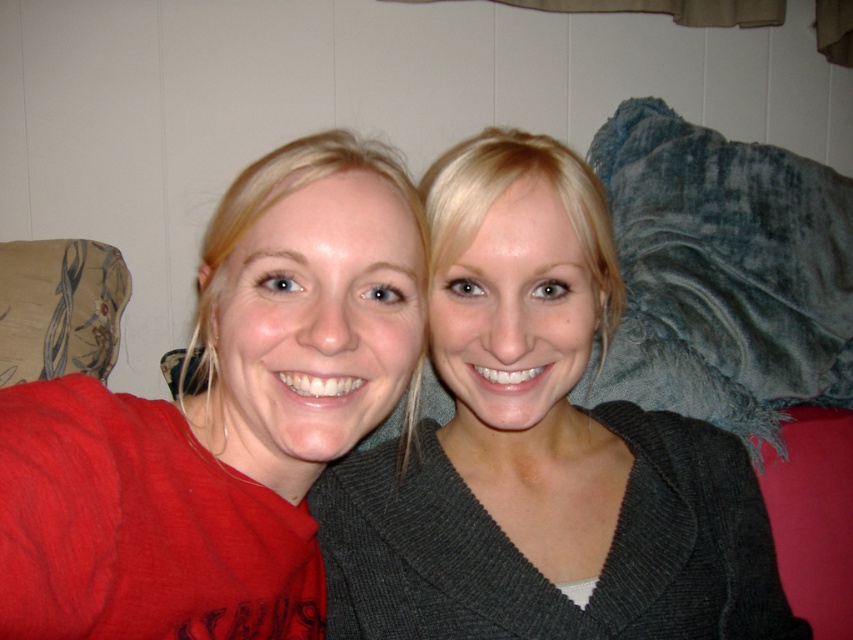
Consider the image. You are a photographer setting up for a group photo. You notice the red matte shirt at left and the floral fabric pillow at left in the frame. Which object should you adjust to ensure both are fully visible in the photo?

The red matte shirt at left is much taller than the floral fabric pillow at left, so you should lower the camera angle or adjust the pillow to ensure both are fully visible in the photo.

You are designing a new seating arrangement and need to ensure that the matte gray sweater at center and the floral fabric pillow at left can both fit on a small table. The table has limited space. Based on their sizes, which object should you prioritize placing first to ensure both fit?

The matte gray sweater at center is larger in size than the floral fabric pillow at left, so you should prioritize placing the larger matte gray sweater at center first to ensure there is enough space left for the smaller pillow.

You are a photographer setting up a shot of two people sitting on a couch. You notice the matte gray sweater at center and the floral fabric pillow at left. To ensure the sweater is visible, should you adjust the pillow so it is higher or lower?

The matte gray sweater at center is positioned under the floral fabric pillow at left. To ensure the sweater is visible, you should adjust the pillow so it is higher.